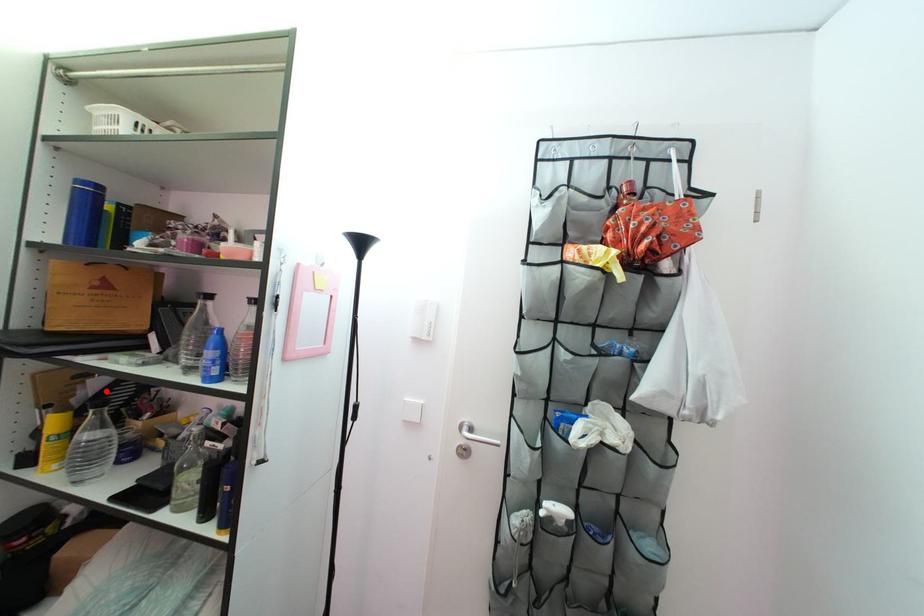
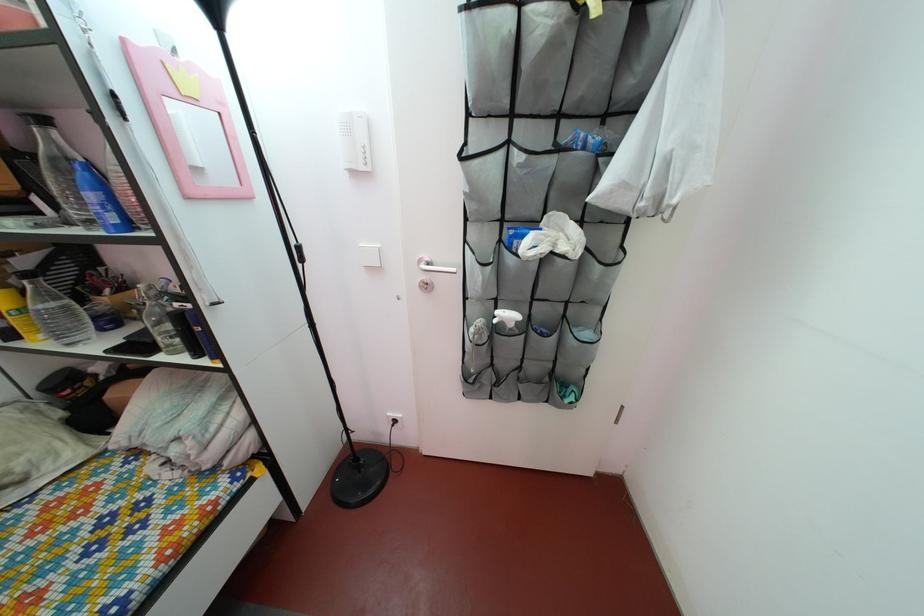
Where in the second image is the point corresponding to the highlighted location from the first image?

(32, 270)